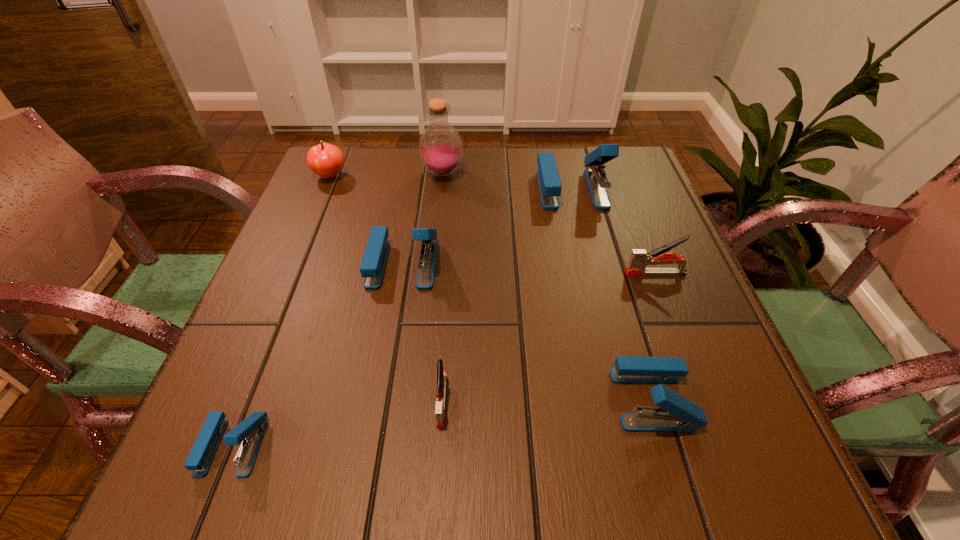
Where is `purple bottle`? This screenshot has width=960, height=540. purple bottle is located at coordinates (440, 146).

Where is `bottle`? Image resolution: width=960 pixels, height=540 pixels. bottle is located at coordinates (440, 146).

Locate an element on the screen. The width and height of the screenshot is (960, 540). the farthest stapler is located at coordinates (549, 182).

You are a GUI agent. You are given a task and a screenshot of the screen. Output one action in this format:
    pyautogui.click(x=<x>, y=<y>)
    Task: Click on the tallest stapler
    The height and width of the screenshot is (540, 960).
    Given the screenshot: What is the action you would take?
    pyautogui.click(x=549, y=182)

Identify the location of the third nearest blue stapler. (372, 267).

The height and width of the screenshot is (540, 960). Identify the location of the second stapler from left to right. (372, 267).

The height and width of the screenshot is (540, 960). What are the coordinates of `the bigger gray stapler` in the screenshot? It's located at (640, 258).

Identify the location of the right gray stapler. (640, 258).

The height and width of the screenshot is (540, 960). What are the coordinates of `apple` in the screenshot? It's located at (326, 160).

Identify the location of the second smallest blue stapler. Image resolution: width=960 pixels, height=540 pixels. (675, 413).